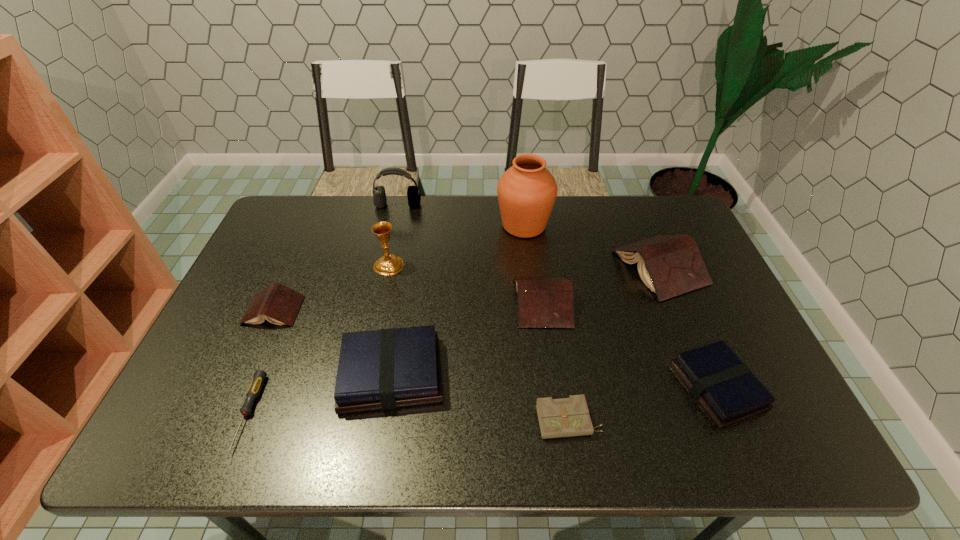
Locate an element on the screen. Image resolution: width=960 pixels, height=540 pixels. blank space located 0.390m on the right of the second biggest brown book is located at coordinates (708, 302).

You are a GUI agent. You are given a task and a screenshot of the screen. Output one action in this format:
    pyautogui.click(x=<x>, y=<y>)
    Task: Click on the vacant space located 0.160m on the right of the left blue book
    This screenshot has height=540, width=960.
    Given the screenshot: What is the action you would take?
    pyautogui.click(x=511, y=374)

Identify the location of vacant space located 0.250m on the front of the leftmost brown book. (228, 414).

Locate an element on the screen. vacant space located on the left of the right blue book is located at coordinates (601, 387).

The image size is (960, 540). Identify the location of free spot located 0.380m on the left of the diary. (368, 421).

Image resolution: width=960 pixels, height=540 pixels. What are the coordinates of `urn present at the far edge` in the screenshot? It's located at (527, 191).

The image size is (960, 540). I want to click on headset that is at the far edge, so click(379, 199).

I want to click on book that is at the far edge, so click(670, 265).

Locate an element on the screen. This screenshot has height=540, width=960. book positioned at the near edge is located at coordinates (725, 387).

Identify the location of diary at the near edge. point(566,417).